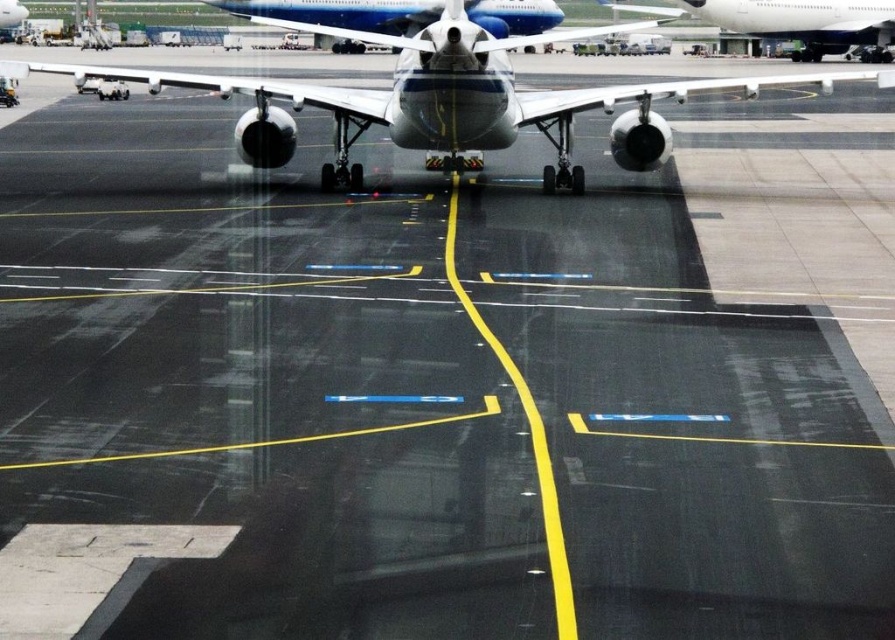
Which is more to the left, metallic gray airplane at center or white glossy airplane at upper right?

metallic gray airplane at center

Can you confirm if metallic gray airplane at center is thinner than white glossy airplane at upper right?

No.

Is point (239, 152) positioned before point (763, 33)?

Yes, point (239, 152) is in front of point (763, 33).

Identify the location of metallic gray airplane at center. (444, 99).